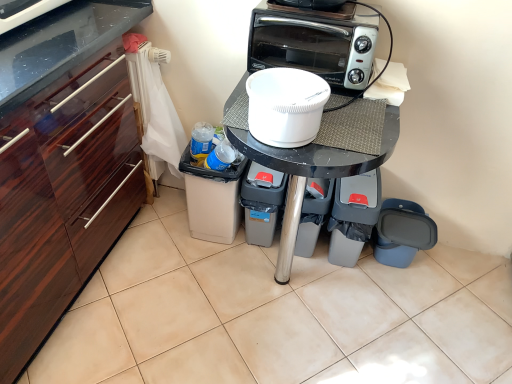
Find the location of a particular element. free location in front of blue plastic trash can at lower right, acting as the 1th appliance starting from the right is located at coordinates (406, 305).